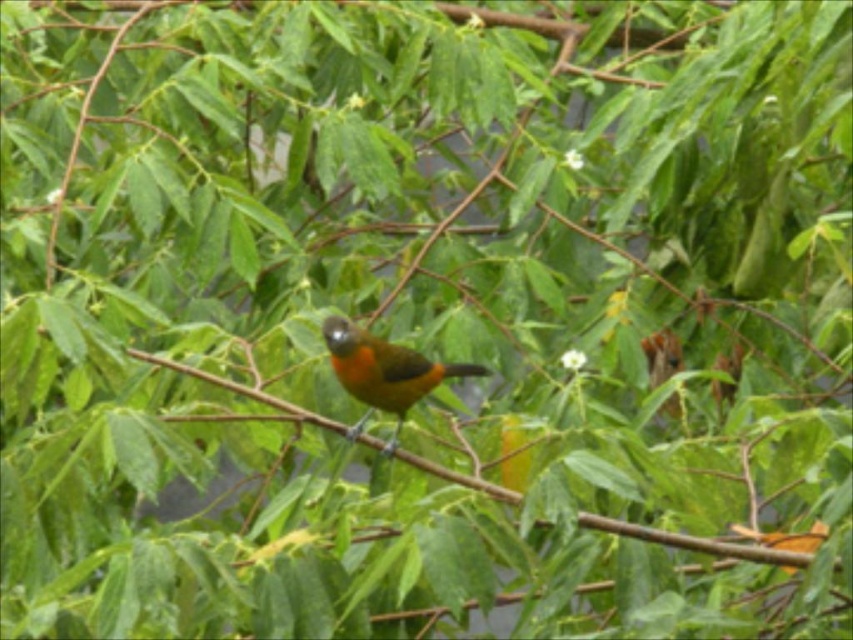
You are an ornithologist observing the bird in the image. You notice a point at coordinates point (695, 541). What object is located at that point?

The point (695, 541) is occupied by the green matte branch at center.

You are a photographer trying to capture a clear photo of the orange matte bird at center. However, the green matte branch at center is blocking part of the bird. Can you adjust your position to get a better shot without moving the branch?

The green matte branch at center is in front of the orange matte bird at center, so moving your camera position slightly to the side might allow you to see around the branch and capture the bird clearly.

You are a small insect trying to crawl from the green matte branch at center to the orange matte bird at center. Given that your maximum crawling distance is 15 centimeters, can you reach the bird?

The green matte branch at center and orange matte bird at center are 17.82 centimeters apart from each other. Since your maximum crawling distance is 15 centimeters, you cannot reach the bird.